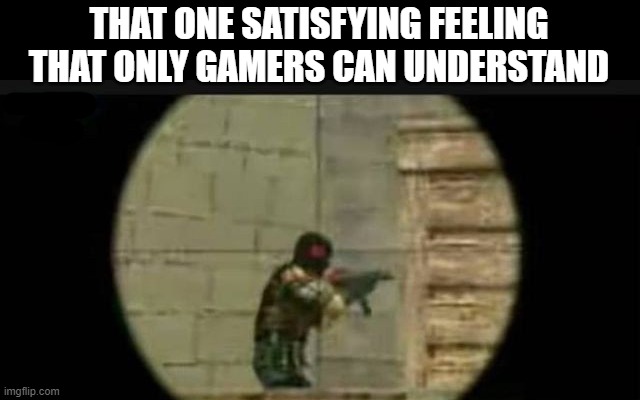
Locate an element on the screen. walls is located at coordinates (458, 218), (216, 203).